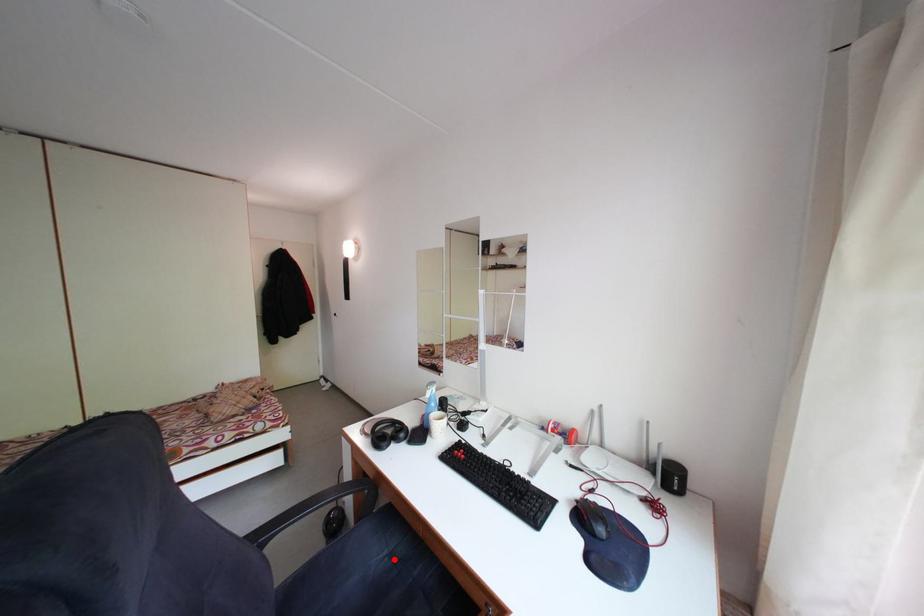
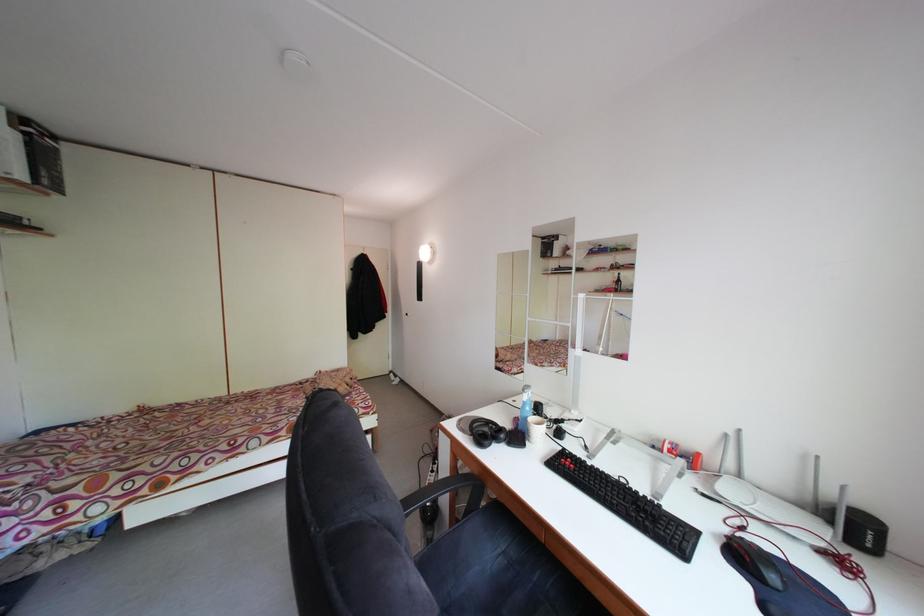
Where in the second image is the point corresponding to the highlighted location from the first image?

(507, 557)